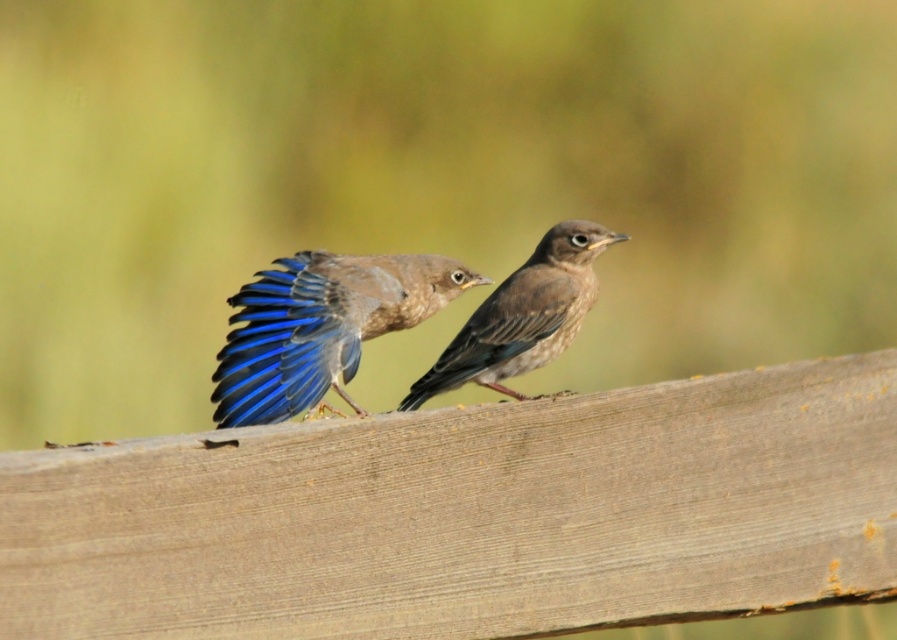
You are a birdwatcher standing in front of the wooden surface where the two birds are perched. You notice the brown wooden plank at center and the blue glossy wing at center. Which object is nearer to you?

The brown wooden plank at center is closer to the viewer than the blue glossy wing at center.

You are a birdwatcher observing two birds in a park. You notice the blue glossy wing at center and the brown matte bird at center. Which object is wider?

The blue glossy wing at center is wider than the brown matte bird at center.

You are standing in a park and see the brown wooden plank at center and the brown matte bird at center. Which object is closer to the ground?

The brown wooden plank at center is closer to the ground because it is located below the brown matte bird at center.